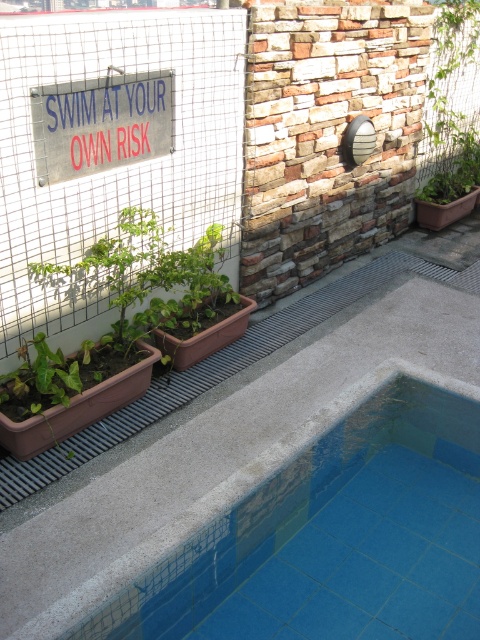
Does blue tile swimming pool at lower center have a larger size compared to green leafy plant at upper right?

Yes.

Does blue tile swimming pool at lower center appear under green leafy plant at upper right?

Correct, blue tile swimming pool at lower center is located below green leafy plant at upper right.

What do you see at coordinates (305, 528) in the screenshot? This screenshot has height=640, width=480. I see `blue tile swimming pool at lower center` at bounding box center [305, 528].

This screenshot has height=640, width=480. In order to click on blue tile swimming pool at lower center in this screenshot , I will do `click(305, 528)`.

Image resolution: width=480 pixels, height=640 pixels. What do you see at coordinates (100, 124) in the screenshot?
I see `metallic sign at upper left` at bounding box center [100, 124].

Is point (110, 140) positioned behind point (436, 108)?

No, it is in front of (436, 108).

Image resolution: width=480 pixels, height=640 pixels. Identify the location of metallic sign at upper left. (100, 124).

Is blue tile swimming pool at lower center wider than metallic sign at upper left?

Yes, blue tile swimming pool at lower center is wider than metallic sign at upper left.

Who is more distant from viewer, (180, 611) or (38, 145)?

Positioned behind is point (38, 145).

This screenshot has width=480, height=640. What do you see at coordinates (305, 528) in the screenshot?
I see `blue tile swimming pool at lower center` at bounding box center [305, 528].

At what (x,y) coordinates should I click in order to perform the action: click on blue tile swimming pool at lower center. Please return your answer as a coordinate pair (x, y). Looking at the image, I should click on (305, 528).